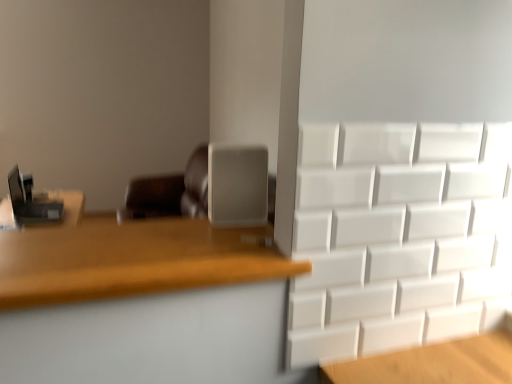
The height and width of the screenshot is (384, 512). Find the location of `vacant space that is to the left of matte gray speaker at center`. vacant space that is to the left of matte gray speaker at center is located at coordinates (176, 229).